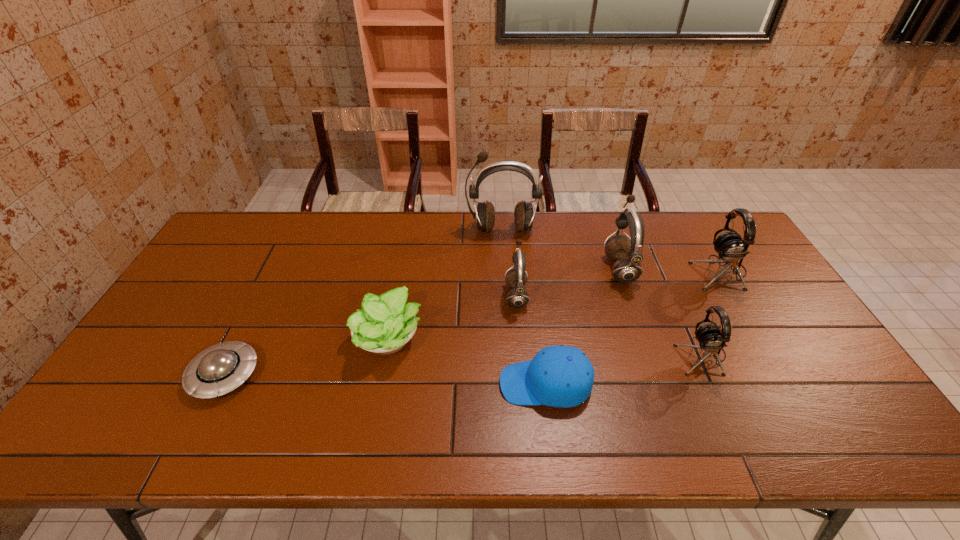
Find the location of `free space between the seventh object from left to right and the rightmost object`. free space between the seventh object from left to right and the rightmost object is located at coordinates (711, 314).

At what (x,y) coordinates should I click in order to perform the action: click on free space between the smallest brown earphone and the cap. Please return your answer as a coordinate pair (x, y). This screenshot has width=960, height=540. Looking at the image, I should click on [x=531, y=340].

What are the coordinates of `empty location between the smallest brown earphone and the lettuce` in the screenshot? It's located at (453, 316).

Locate which object is the closest to the biggest brown earphone. Please provide its 2D coordinates. Your answer should be formatted as a tuple, i.e. [(x, y)], where the tuple contains the x and y coordinates of a point satisfying the conditions above.

[(518, 297)]

You are a GUI agent. You are given a task and a screenshot of the screen. Output one action in this format:
    pyautogui.click(x=<x>, y=<y>)
    Task: Click on the object that is the fourth closest to the seventh object from right to left
    This screenshot has height=540, width=960.
    Given the screenshot: What is the action you would take?
    pyautogui.click(x=484, y=216)

Identify which earphone is located as the nearest to the gray saucer. Please provide its 2D coordinates. Your answer should be formatted as a tuple, i.e. [(x, y)], where the tuple contains the x and y coordinates of a point satisfying the conditions above.

[(518, 297)]

You are a GUI agent. You are given a task and a screenshot of the screen. Output one action in this format:
    pyautogui.click(x=<x>, y=<y>)
    Task: Click on the earphone that stands as the second closest to the lettuce
    
    Given the screenshot: What is the action you would take?
    pyautogui.click(x=484, y=216)

Find the location of a particular element. the second closest brown earphone to the farthest brown earphone is located at coordinates (627, 253).

The height and width of the screenshot is (540, 960). What are the coordinates of `the third closest brown earphone to the right black earphone` in the screenshot? It's located at (518, 297).

In order to click on free spot that satisfies the following two spatial constraints: 1. on the ear pads of the bigger black earphone; 2. on the right side of the third earphone from right to left in this screenshot , I will do `click(620, 272)`.